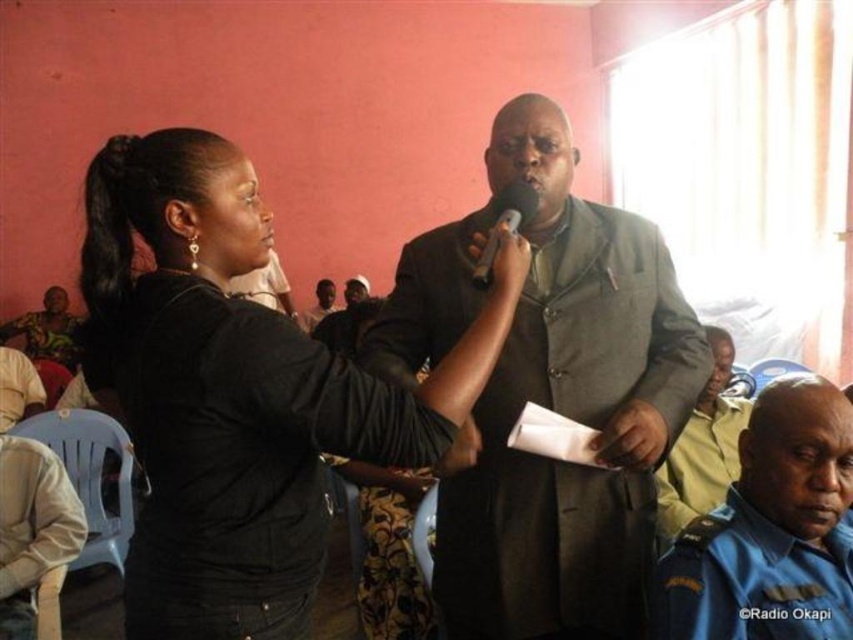
Is the position of black matte jacket at center more distant than that of matte black microphone at center?

That is False.

Image resolution: width=853 pixels, height=640 pixels. Find the location of `black matte jacket at center`. black matte jacket at center is located at coordinates (236, 392).

Between point (293, 612) and point (601, 369), which one is positioned in front?

Point (293, 612) is more forward.

Locate an element on the screen. The image size is (853, 640). black matte jacket at center is located at coordinates (236, 392).

Who is taller, blue uniform at lower right or matte black microphone at center?

With more height is blue uniform at lower right.

Where is `blue uniform at lower right`? Image resolution: width=853 pixels, height=640 pixels. blue uniform at lower right is located at coordinates (770, 529).

At what (x,y) coordinates should I click in order to perform the action: click on blue uniform at lower right. Please return your answer as a coordinate pair (x, y). The height and width of the screenshot is (640, 853). Looking at the image, I should click on (770, 529).